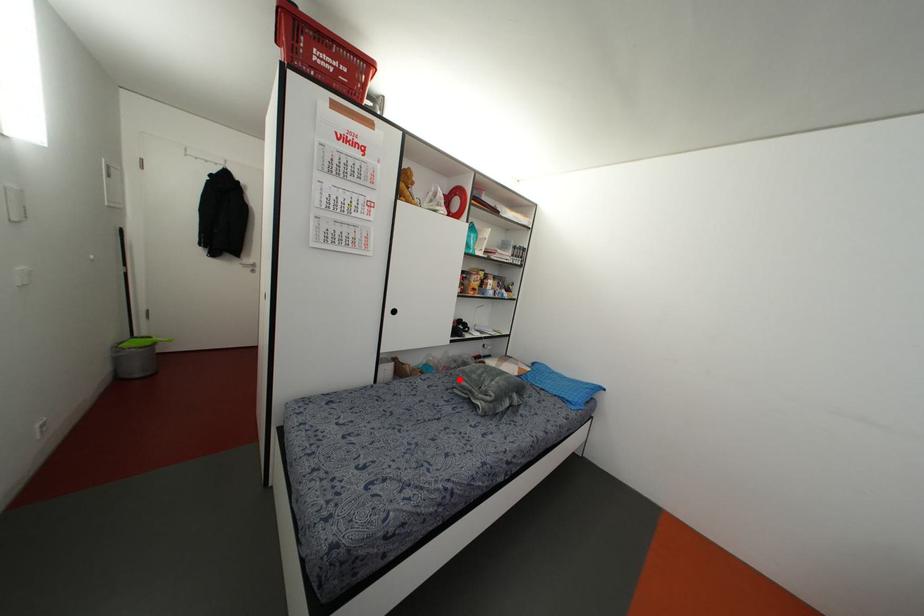
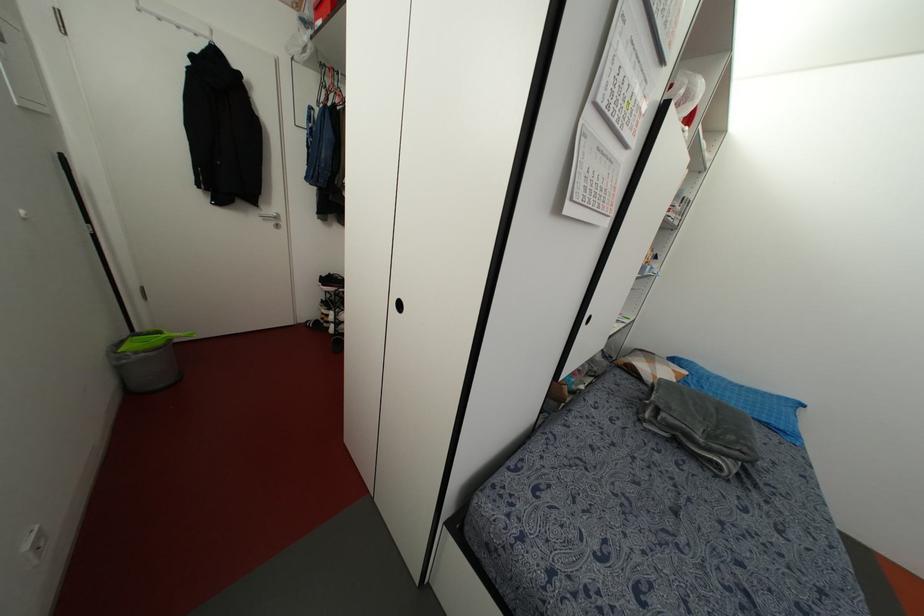
Locate, in the second image, the point that corresponds to the highlighted location in the first image.

(663, 415)